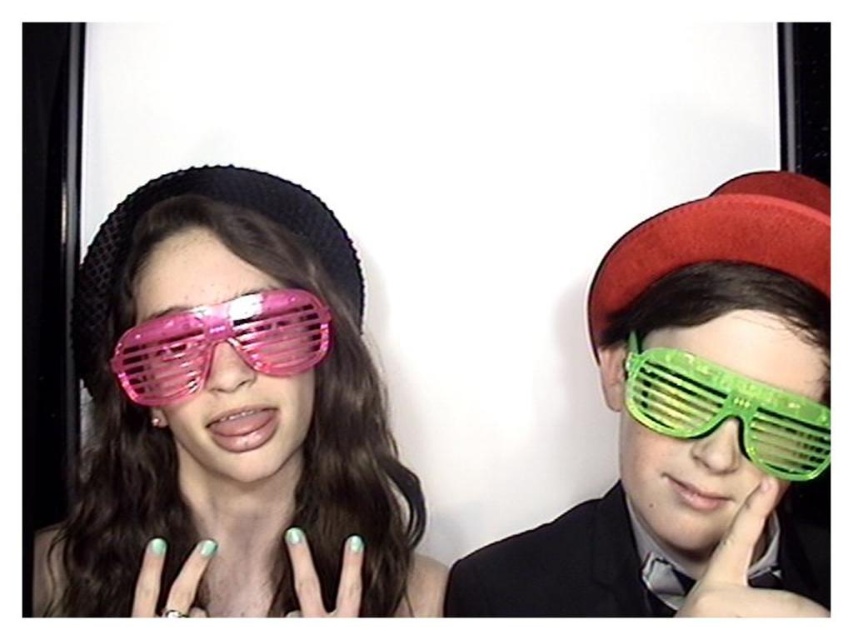
Can you confirm if green translucent glasses at right is shorter than green matte nails at center?

No.

Which is below, green translucent glasses at right or green matte nails at center?

green matte nails at center

Locate an element on the screen. green translucent glasses at right is located at coordinates click(x=679, y=474).

Between green plastic glasses at right and red matte hat at upper right, which one appears on the right side from the viewer's perspective?

Positioned to the right is green plastic glasses at right.

Which is above, green plastic glasses at right or red matte hat at upper right?

red matte hat at upper right is above.

Does point (544, 561) lie in front of point (730, 184)?

No, it is behind (730, 184).

The image size is (853, 640). Identify the location of green plastic glasses at right. (694, 422).

Is green translucent glasses at right shorter than teal matte nails at center?

No.

Does green translucent glasses at right appear on the left side of teal matte nails at center?

Incorrect, green translucent glasses at right is not on the left side of teal matte nails at center.

Identify the location of green translucent glasses at right. (679, 474).